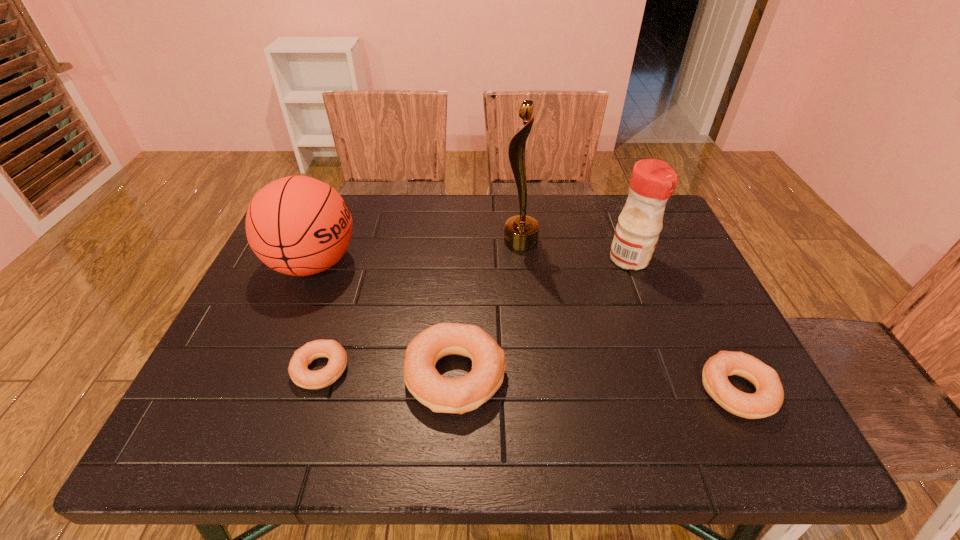
Identify the location of the shortest bagel. The height and width of the screenshot is (540, 960). (298, 370).

Where is `the shortest object`? the shortest object is located at coordinates (298, 370).

In order to click on the third object from left to right in this screenshot , I will do `click(460, 395)`.

At what (x,y) coordinates should I click in order to perform the action: click on the tallest bagel. Please return your answer as a coordinate pair (x, y). Looking at the image, I should click on (460, 395).

The height and width of the screenshot is (540, 960). Find the location of `the second tallest bagel`. the second tallest bagel is located at coordinates (768, 398).

Find the location of `the rightmost bagel`. the rightmost bagel is located at coordinates (768, 398).

Locate an element on the screen. the tallest object is located at coordinates (521, 232).

Identify the location of award. The image size is (960, 540). (521, 232).

Identify the location of basketball. (297, 225).

The image size is (960, 540). What are the coordinates of `condiment` in the screenshot? It's located at (652, 183).